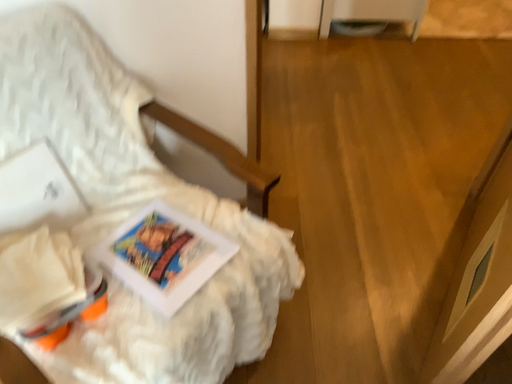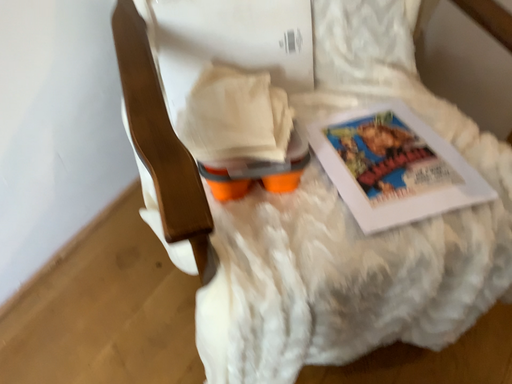
Question: How did the camera likely rotate when shooting the video?

Choices:
 (A) rotated right
 (B) rotated left

Answer: (B)